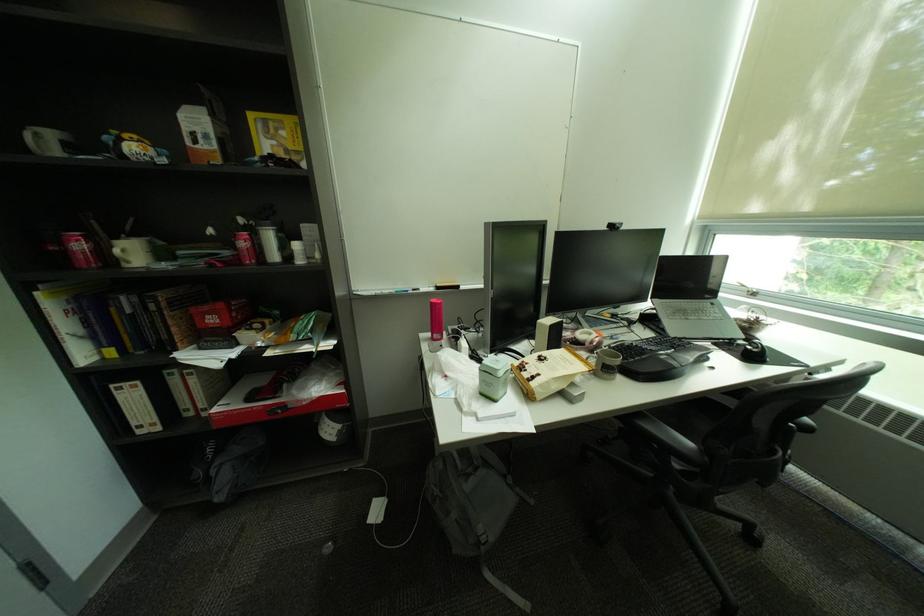
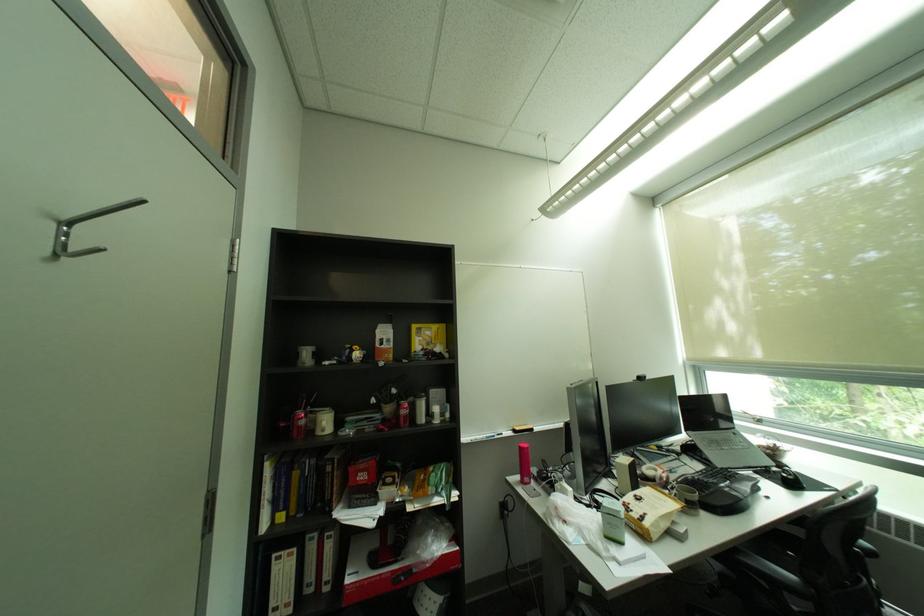
In the second image, find the point that corresponds to (614,365) in the first image.

(697, 500)